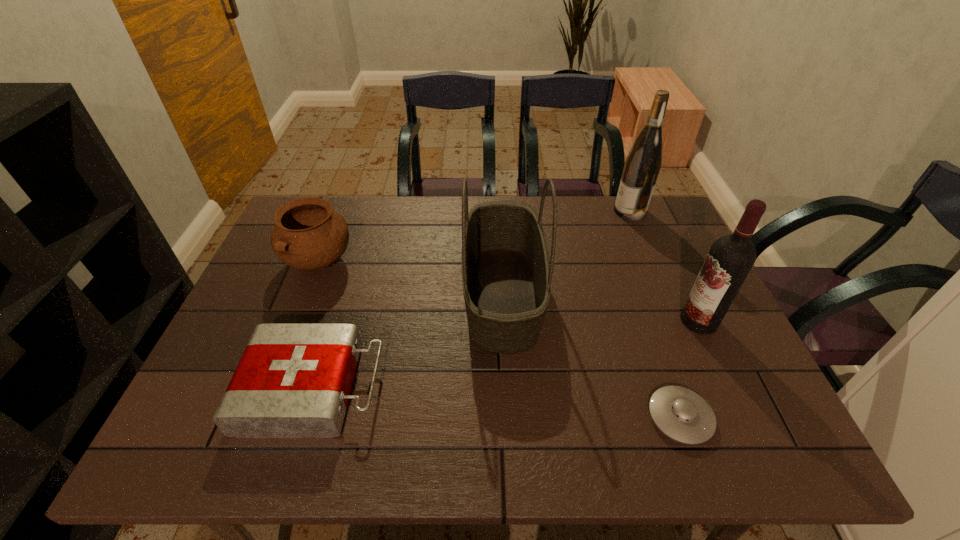
Find the location of `the first-aid kit that is at the left edge`. the first-aid kit that is at the left edge is located at coordinates (293, 380).

At what (x,y) coordinates should I click in order to perform the action: click on saucer that is positioned at the right edge. Please return your answer as a coordinate pair (x, y). Image resolution: width=960 pixels, height=540 pixels. Looking at the image, I should click on (681, 414).

You are a GUI agent. You are given a task and a screenshot of the screen. Output one action in this format:
    pyautogui.click(x=<x>, y=<y>)
    Task: Click on the object that is at the far left corner
    The width and height of the screenshot is (960, 540).
    Given the screenshot: What is the action you would take?
    click(308, 235)

Identify the location of object that is at the near left corner. The height and width of the screenshot is (540, 960). [293, 380].

I want to click on object that is at the far right corner, so click(643, 163).

Find the location of a particular element. The height and width of the screenshot is (540, 960). object located in the near right corner section of the desktop is located at coordinates (681, 414).

Locate an element on the screen. Image resolution: width=960 pixels, height=540 pixels. vacant area at the far edge of the desktop is located at coordinates (422, 199).

Identify the location of vacant space at the near edge. (661, 435).

The height and width of the screenshot is (540, 960). I want to click on blank area at the left edge, so click(x=272, y=299).

In the image, there is a desktop. In order to click on vacant space at the right edge in this screenshot , I will do `click(705, 356)`.